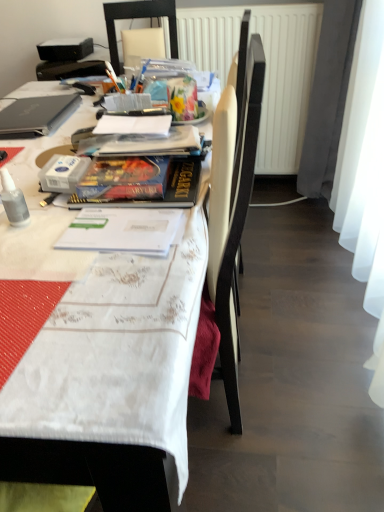
You are a GUI agent. You are given a task and a screenshot of the screen. Output one action in this format:
    pyautogui.click(x=<x>, y=<y>)
    Task: Click on the free spot to the right of transparent plastic bottle at left
    
    Given the screenshot: What is the action you would take?
    pyautogui.click(x=83, y=222)